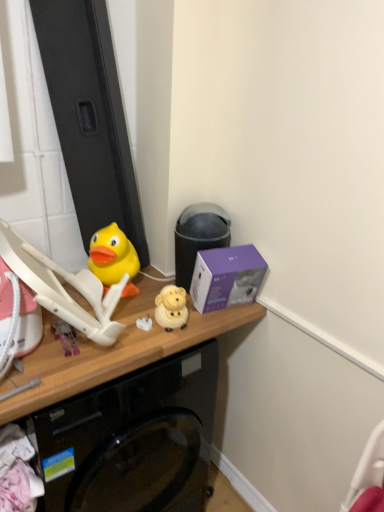
At what (x,y) coordinates should I click in order to perform the action: click on vacant space underneath yellow rubber duck at left, which is counted as the third toy, starting from the right (from a real-world perspective). Please return your answer as a coordinate pair (x, y). This screenshot has height=512, width=384. Looking at the image, I should click on (133, 293).